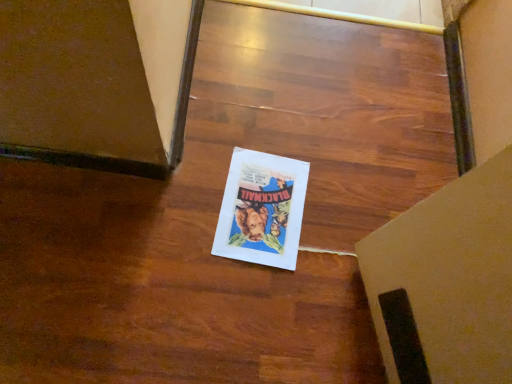
Find the location of a particular element. The image size is (512, 384). free space to the left of matte paper poster at center is located at coordinates (183, 190).